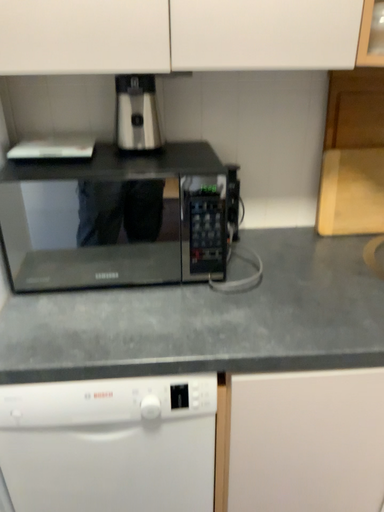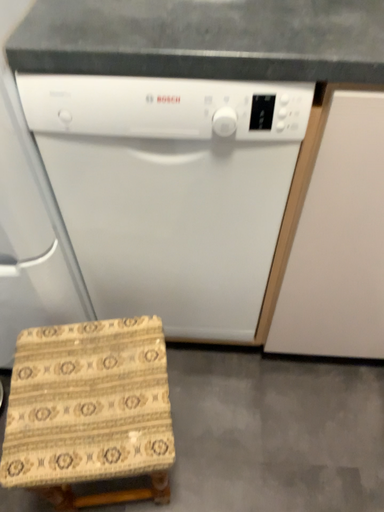
Question: How did the camera likely rotate when shooting the video?

Choices:
 (A) rotated upward
 (B) rotated downward

Answer: (B)